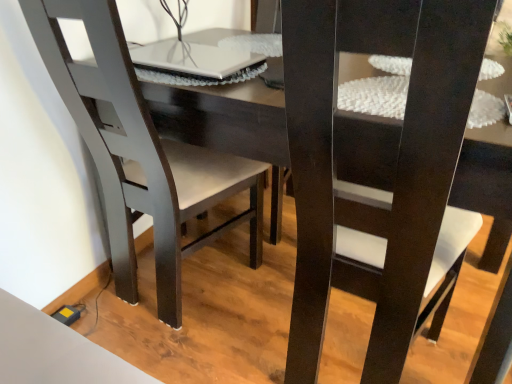
Question: Is matte black chair at center, which is counted as the 1th chair, starting from the right, wider or thinner than matte black chair at left, the first chair when ordered from left to right?

Choices:
 (A) thin
 (B) wide

Answer: (B)

Question: In the image, is matte black chair at center, which is counted as the 1th chair, starting from the right, positioned in front of or behind matte black chair at left, which is the 2th chair from right to left?

Choices:
 (A) behind
 (B) front

Answer: (B)

Question: Which is nearer to the white glossy laptop at upper center?

Choices:
 (A) matte black chair at left, which is the 2th chair from right to left
 (B) matte black chair at center, the 2th chair positioned from the left

Answer: (A)

Question: Which object is positioned closest to the matte black chair at center, the 2th chair positioned from the left?

Choices:
 (A) white glossy laptop at upper center
 (B) matte black chair at left, the first chair when ordered from left to right

Answer: (B)